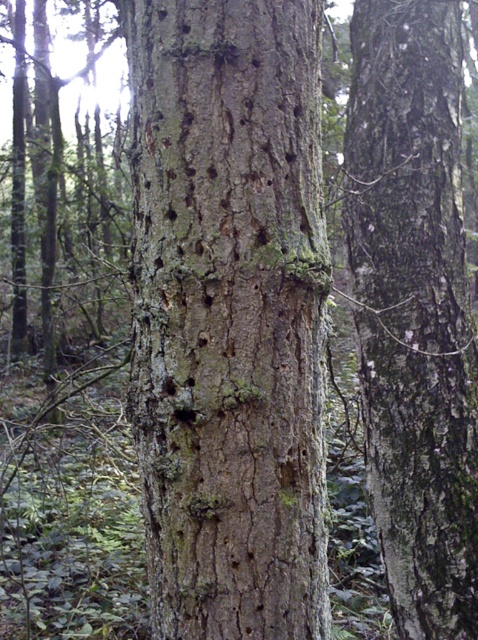
The height and width of the screenshot is (640, 478). Describe the element at coordinates (229, 314) in the screenshot. I see `rough bark tree trunk at center` at that location.

Can you confirm if rough bark tree trunk at center is smaller than smooth brown bark at center?

Yes.

Is point (239, 88) behind point (360, 60)?

That is False.

Locate an element on the screen. rough bark tree trunk at center is located at coordinates (229, 314).